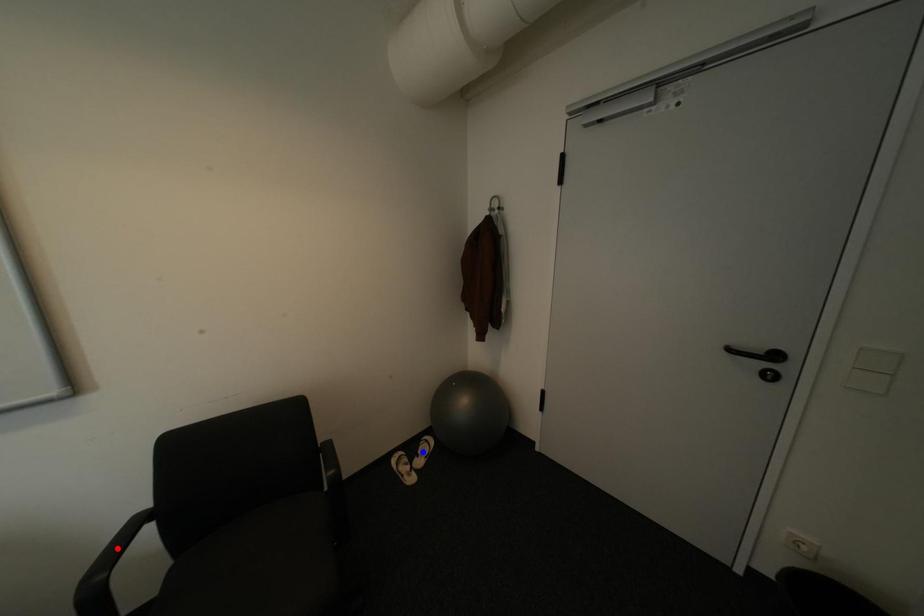
Question: Two points are marked on the image. Which point is closer to the camera?

Choices:
 (A) Blue point is closer.
 (B) Red point is closer.

Answer: (B)